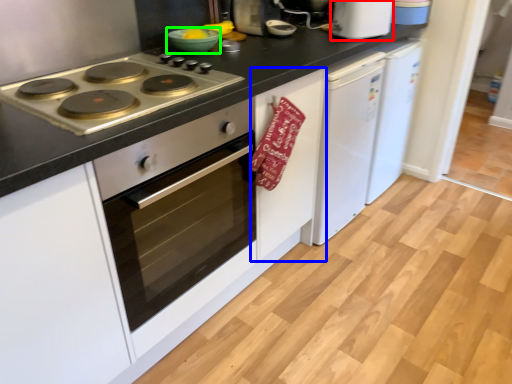
Question: Which object is positioned closest to kitchen appliance (highlighted by a red box)? Select from cabinetry (highlighted by a blue box) and bowl (highlighted by a green box).

Choices:
 (A) cabinetry
 (B) bowl

Answer: (A)